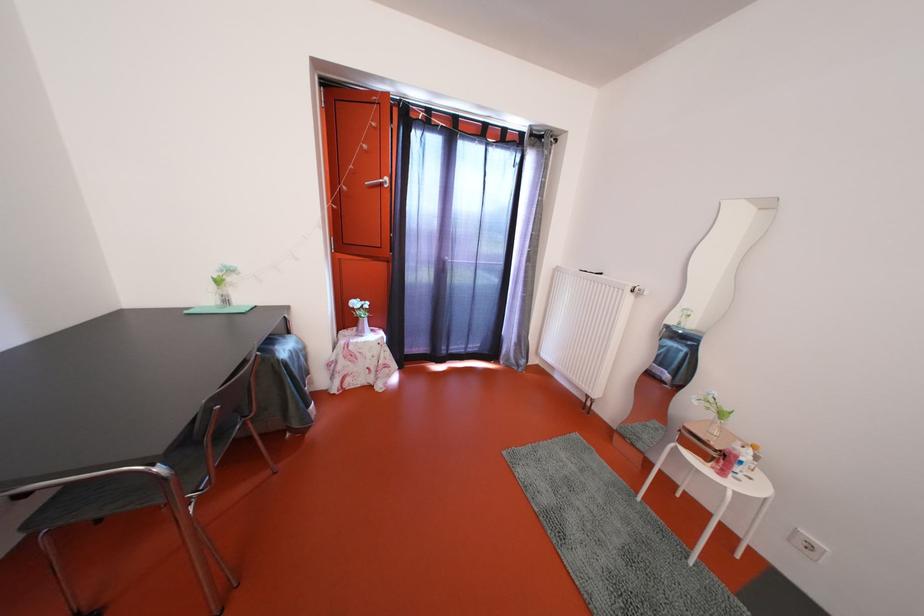
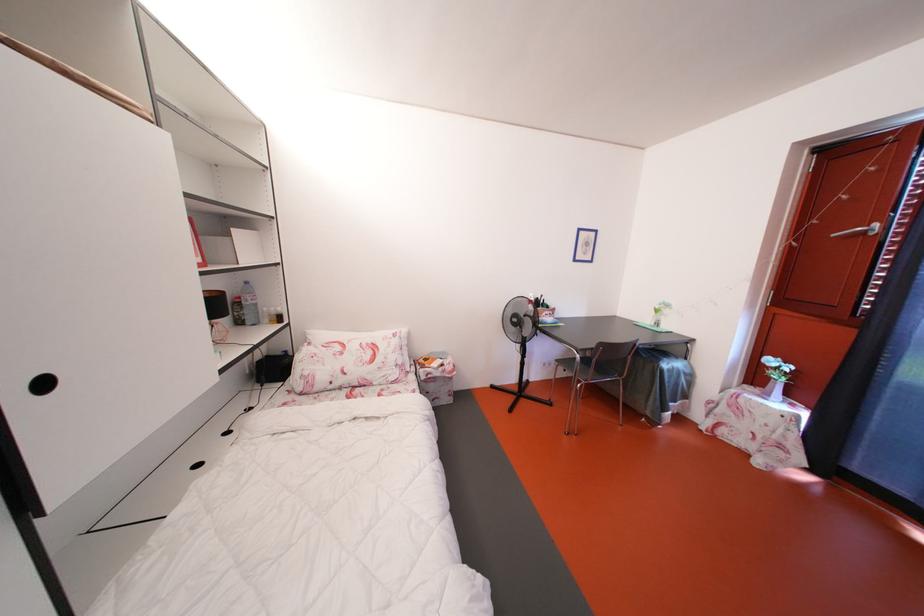
The point at (165, 475) is marked in the first image. Where is the corresponding point in the second image?

(585, 362)